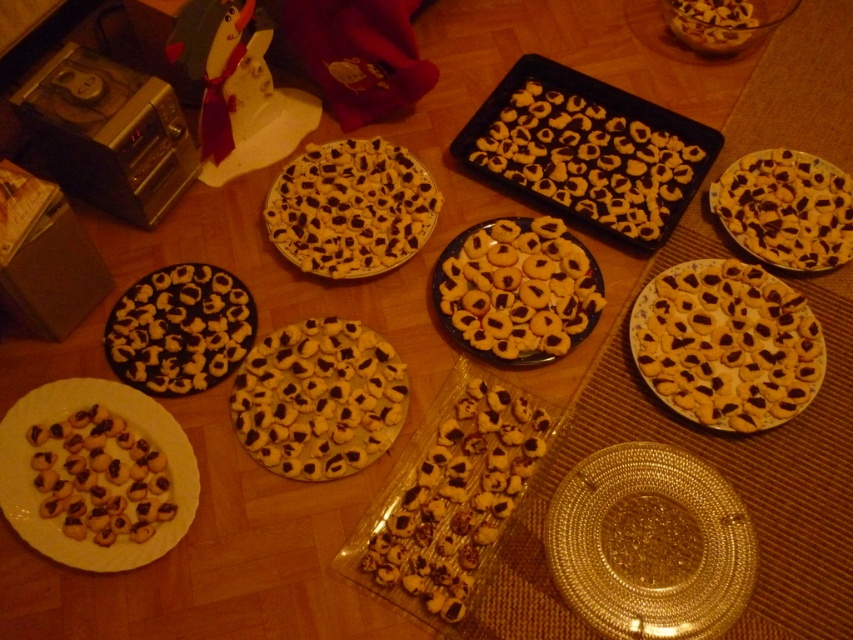
Question: Which is nearer to the white glossy cookie at center?

Choices:
 (A) matte black cookies at center
 (B) white crumbly cookies at upper center

Answer: (A)

Question: Is gold textured platter at lower right further to the viewer compared to matte black cookies at center?

Choices:
 (A) no
 (B) yes

Answer: (A)

Question: Which point is closer to the camera taking this photo?

Choices:
 (A) (231, 365)
 (B) (466, 538)

Answer: (B)

Question: Is the position of golden brown cookie at center less distant than that of yellow matte cookie at upper right?

Choices:
 (A) yes
 (B) no

Answer: (A)

Question: Which point is closer to the camera?

Choices:
 (A) 294,454
 (B) 801,209

Answer: (A)

Question: Is matte yellow cookie at center right further to the viewer compared to white crumbly cookies at upper center?

Choices:
 (A) yes
 (B) no

Answer: (B)